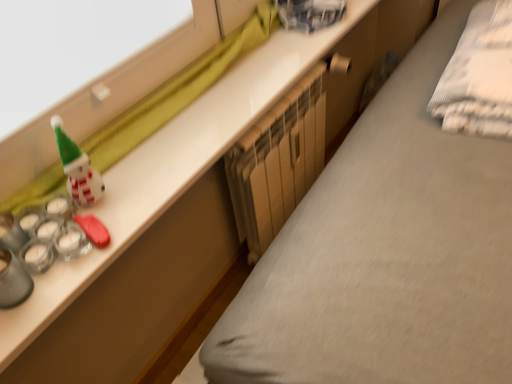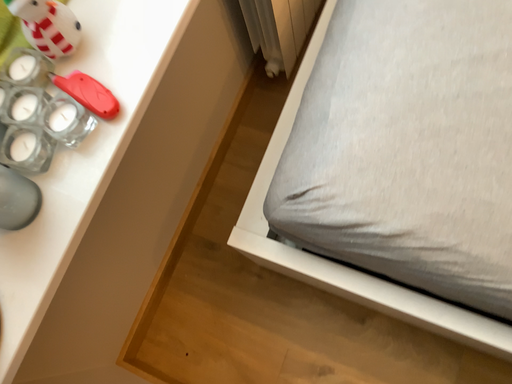
Question: Which way did the camera rotate in the video?

Choices:
 (A) rotated downward
 (B) rotated upward

Answer: (A)